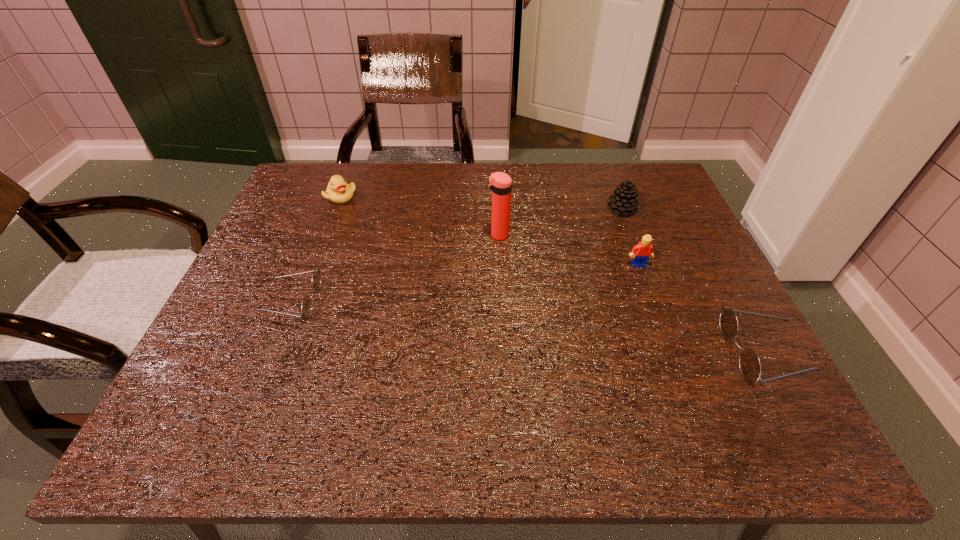
Locate an element on the screen. The width and height of the screenshot is (960, 540). free space at the far right corner of the desktop is located at coordinates (662, 184).

Locate an element on the screen. The height and width of the screenshot is (540, 960). free space between the shortest object and the fourth farthest object is located at coordinates (467, 284).

Image resolution: width=960 pixels, height=540 pixels. In order to click on free space between the duckling and the rightmost object in this screenshot , I will do `click(551, 275)`.

This screenshot has height=540, width=960. I want to click on free point between the tallest object and the fourth farthest object, so (568, 250).

I want to click on vacant space that is in between the fourth farthest object and the rightmost object, so (700, 309).

The width and height of the screenshot is (960, 540). I want to click on free space between the duckling and the thermos bottle, so click(x=420, y=216).

This screenshot has height=540, width=960. I want to click on vacant space that's between the duckling and the pinecone, so 481,203.

You are a GUI agent. You are given a task and a screenshot of the screen. Output one action in this format:
    pyautogui.click(x=<x>, y=<y>)
    Task: Click on the vacant space that is in between the taller spectacles and the third object from left to right
    The image size is (960, 540).
    Given the screenshot: What is the action you would take?
    pyautogui.click(x=630, y=295)

Image resolution: width=960 pixels, height=540 pixels. In order to click on vacant area that lies between the left spectacles and the tallest object in this screenshot , I will do `click(396, 269)`.

At what (x,y) coordinates should I click in order to perform the action: click on free space between the third farthest object and the Lego. Please return your answer as a coordinate pair (x, y). Image resolution: width=960 pixels, height=540 pixels. Looking at the image, I should click on (568, 250).